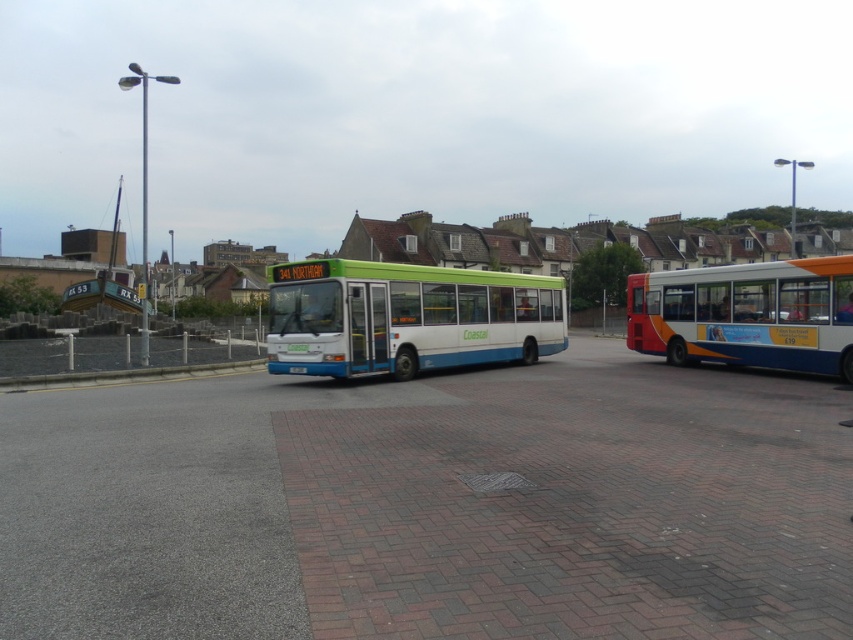
Question: Can you confirm if green matte bus at center is positioned to the right of white plastic bus at right?

Choices:
 (A) no
 (B) yes

Answer: (A)

Question: Among these points, which one is nearest to the camera?

Choices:
 (A) (401, 342)
 (B) (102, 278)

Answer: (A)

Question: Is green matte bus at center further to the viewer compared to white plastic bus at right?

Choices:
 (A) no
 (B) yes

Answer: (A)

Question: Estimate the real-world distances between objects in this image. Which object is farther from the gray concrete curb at lower left?

Choices:
 (A) green matte bus at center
 (B) white plastic bus at right

Answer: (B)

Question: Estimate the real-world distances between objects in this image. Which object is farther from the green matte bus at center?

Choices:
 (A) gray concrete curb at lower left
 (B) green plastic bus at center

Answer: (B)

Question: Does green matte bus at center have a larger size compared to gray concrete curb at lower left?

Choices:
 (A) yes
 (B) no

Answer: (A)